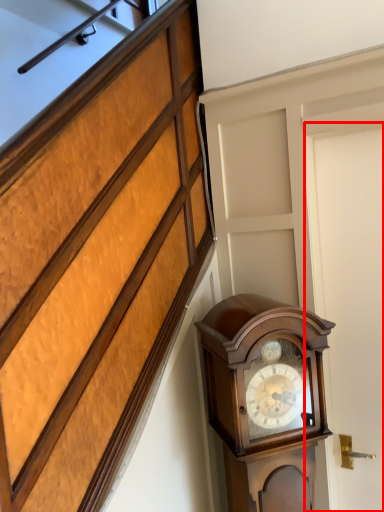
Question: From the image's perspective, what is the correct spatial relationship of door (annotated by the red box) in relation to wall clock?

Choices:
 (A) above
 (B) below

Answer: (A)